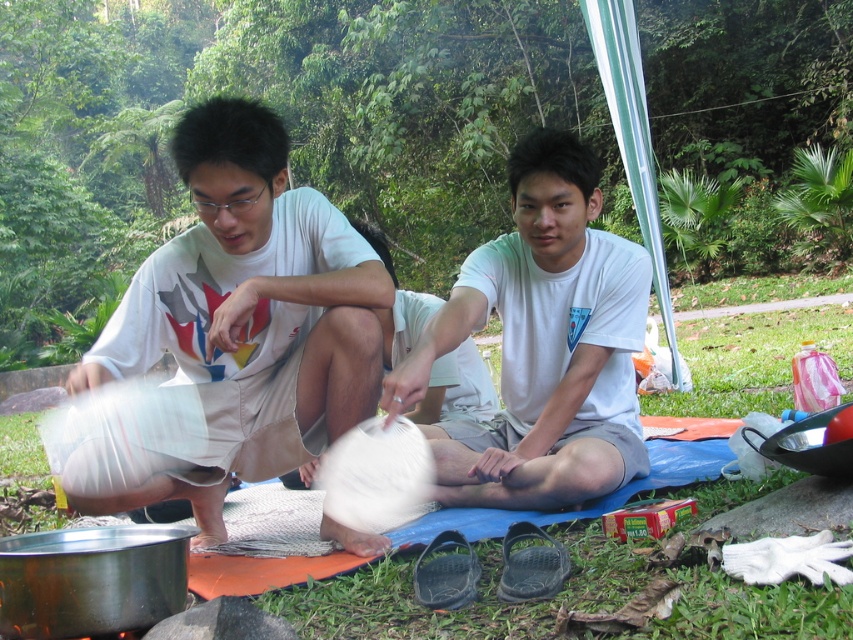
You are planning to hang these two white cotton shirts on a clothesline. The clothesline has a maximum height capacity of 1.2 meters. Given that the white cotton shirt at left is taller than the white cotton shirt at center, which shirt should you place at the bottom to ensure both fit within the clothesline height limit?

The white cotton shirt at center should be placed at the bottom since it is shorter than the white cotton shirt at left, allowing both to fit within the clothesline height limit of 1.2 meters.

You are a photographer standing in front of the two people in the image. You want to take a photo that includes both of them clearly. Which person should you focus on first to ensure they are in focus, the white cotton shirt at left or the white cotton shirt at center?

You should focus on the white cotton shirt at left first because it is closer to the viewer than the white cotton shirt at center, so focusing on the closer one ensures both are in focus when using a camera with depth of field considerations.